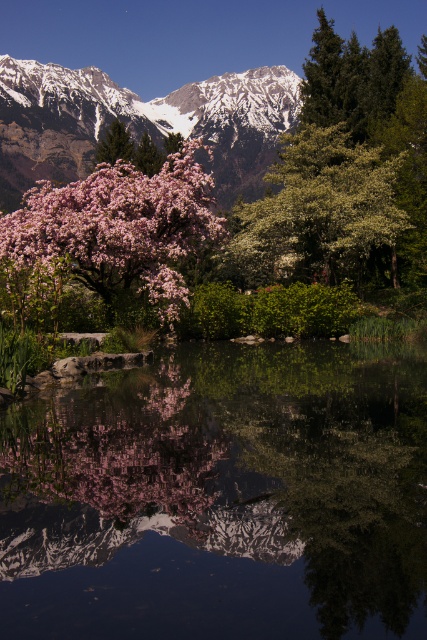
Is transparent glass lake at center to the left of pink blossoms at center from the viewer's perspective?

No, transparent glass lake at center is not to the left of pink blossoms at center.

Does transparent glass lake at center appear over pink blossoms at center?

No, transparent glass lake at center is not above pink blossoms at center.

Is point (170, 474) behind point (173, 296)?

No.

Locate an element on the screen. This screenshot has height=640, width=427. transparent glass lake at center is located at coordinates (221, 499).

Is transparent glass lake at center positioned behind snowy rocky mountain range at upper left?

No, transparent glass lake at center is closer to the viewer.

Does transparent glass lake at center appear on the right side of snowy rocky mountain range at upper left?

Indeed, transparent glass lake at center is positioned on the right side of snowy rocky mountain range at upper left.

Is point (307, 413) in front of point (233, 125)?

Yes, it is.

Image resolution: width=427 pixels, height=640 pixels. Identify the location of transparent glass lake at center. (221, 499).

This screenshot has height=640, width=427. Describe the element at coordinates (140, 122) in the screenshot. I see `snowy rocky mountain range at upper left` at that location.

Who is positioned more to the left, snowy rocky mountain range at upper left or pink blossoms at center?

snowy rocky mountain range at upper left is more to the left.

The width and height of the screenshot is (427, 640). Find the location of `snowy rocky mountain range at upper left`. snowy rocky mountain range at upper left is located at coordinates (140, 122).